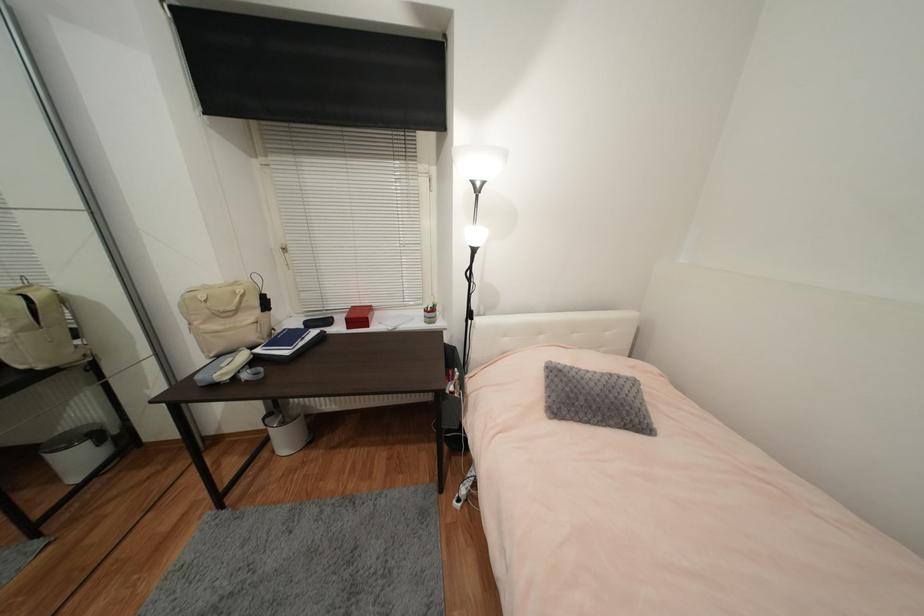
Find where to push the trash can pedal. Please return your answer as a coordinate pair (x, y).

(108, 463)